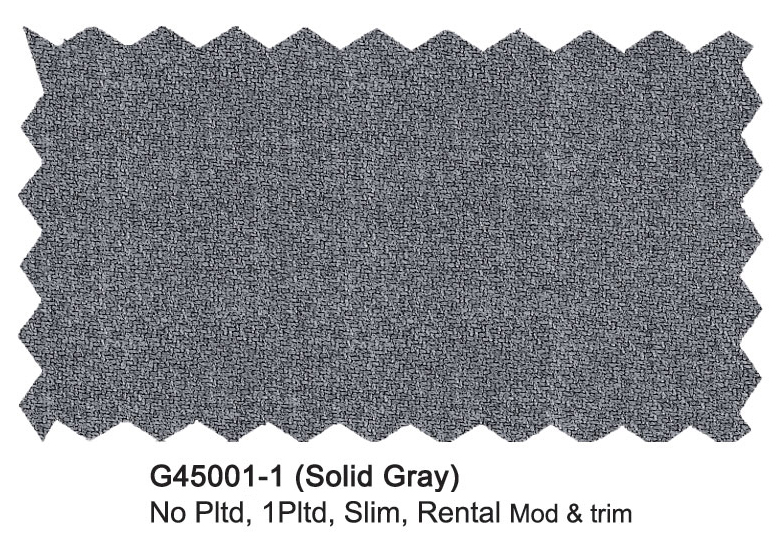
Image resolution: width=784 pixels, height=556 pixels. In order to click on jagged edge of fabric swatch in this screenshot , I will do `click(430, 43)`, `click(351, 434)`, `click(35, 180)`, `click(753, 229)`.